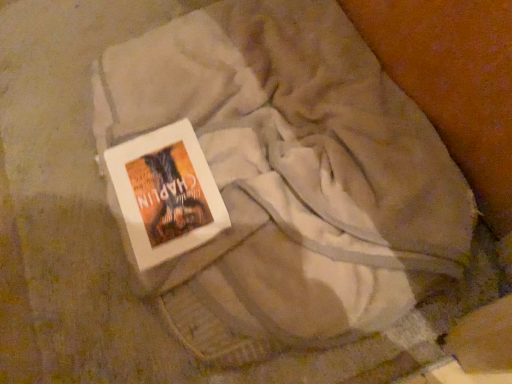
Question: Is white paper book at center wider or thinner than white soft blanket at center?

Choices:
 (A) wide
 (B) thin

Answer: (B)

Question: Considering their positions, is white paper book at center located in front of or behind white soft blanket at center?

Choices:
 (A) front
 (B) behind

Answer: (B)

Question: Visually, is white paper book at center positioned to the left or to the right of white soft blanket at center?

Choices:
 (A) left
 (B) right

Answer: (A)

Question: Which is correct: white soft blanket at center is inside white paper book at center, or outside of it?

Choices:
 (A) outside
 (B) inside

Answer: (A)

Question: Considering the positions of point (234, 314) and point (202, 220), is point (234, 314) closer or farther from the camera than point (202, 220)?

Choices:
 (A) closer
 (B) farther

Answer: (A)

Question: From a real-world perspective, relative to white paper book at center, is white soft blanket at center vertically above or below?

Choices:
 (A) below
 (B) above

Answer: (A)

Question: Is white soft blanket at center in front of or behind white paper book at center in the image?

Choices:
 (A) front
 (B) behind

Answer: (A)